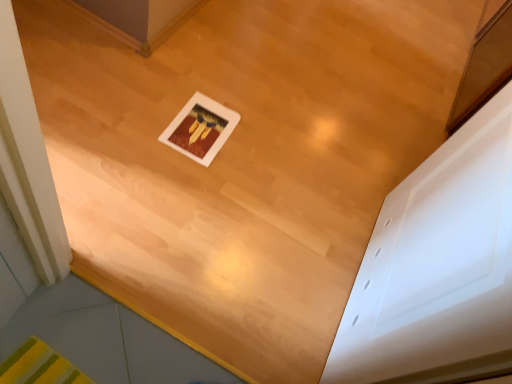
Locate an element on the screen. free space above white matte picture frame at center (from a real-world perspective) is located at coordinates (203, 125).